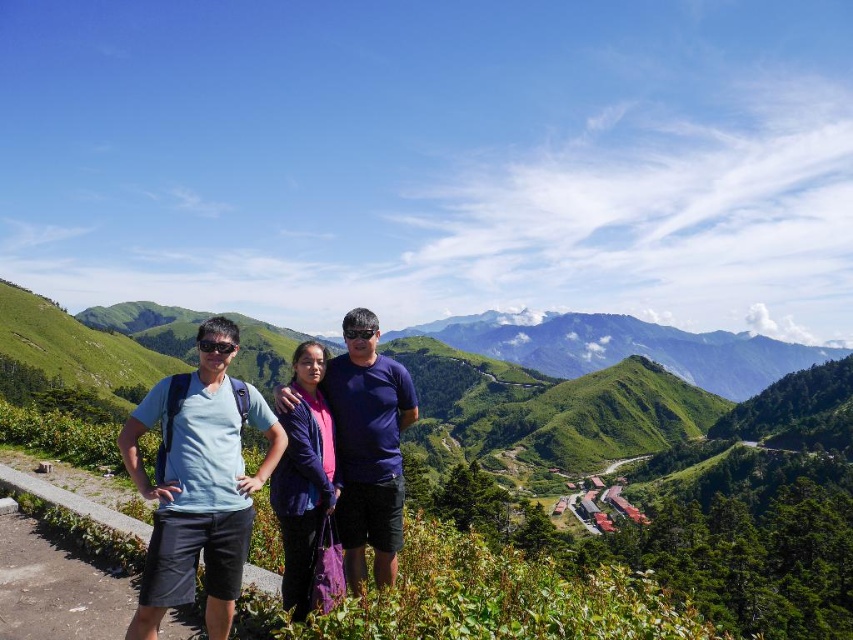
You are a photographer trying to capture the three people in the scene. You notice the matte blue shirt at center and the purple fabric at center. Which object should you focus on first if you want to ensure both are in sharp focus?

You should focus on the purple fabric at center first because it is above the matte blue shirt at center, so focusing on the frontmost object ensures both will be in focus.

You are planning to take a photo of two people wearing a matte blue shirt at center and a purple matte shirt at center. Based on the scene description, which person should stand closer to the camera to ensure both shirts are visible in the frame?

The matte blue shirt at center might be wider than the purple matte shirt at center, so the person wearing the matte blue shirt at center should stand closer to the camera to ensure both shirts are visible in the frame.